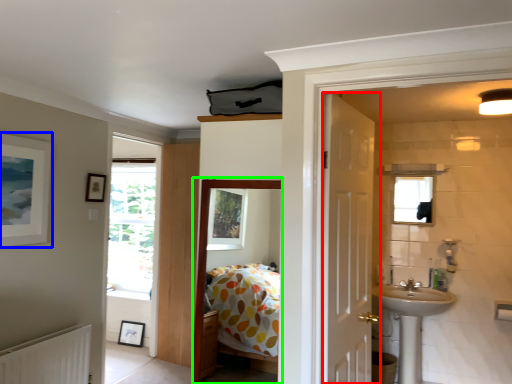
Question: Based on their relative distances, which object is farther from door (highlighted by a red box)? Choose from picture frame (highlighted by a blue box) and corridor (highlighted by a green box).

Choices:
 (A) picture frame
 (B) corridor

Answer: (A)